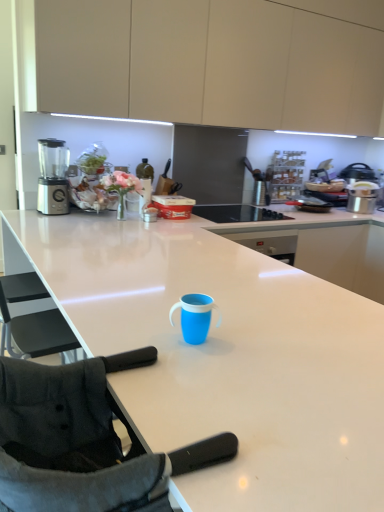
Identify the location of unoccupied region to the right of blue plastic sippy cup at center. (254, 341).